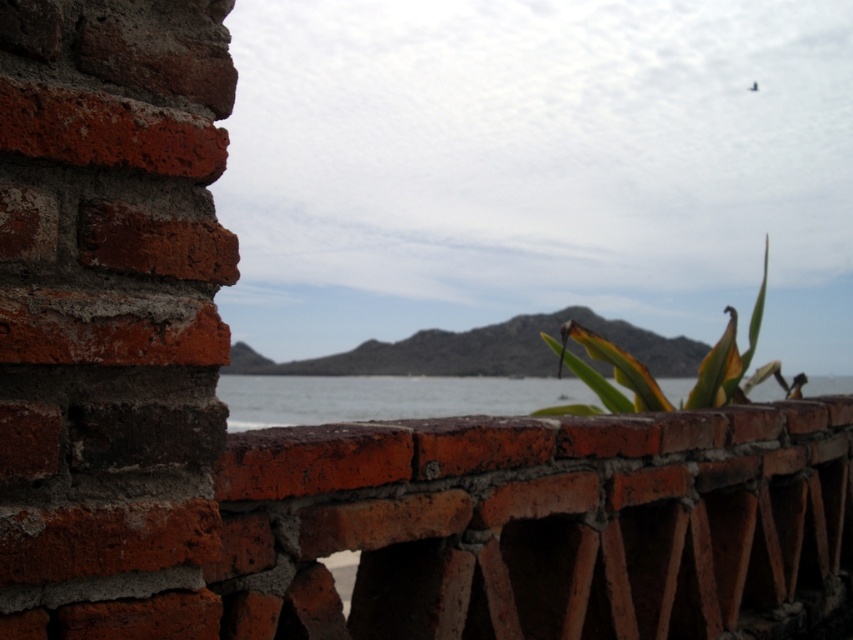
Question: Does clear water at center appear over green leafy plant at center?

Choices:
 (A) no
 (B) yes

Answer: (A)

Question: Among these objects, which one is farthest from the camera?

Choices:
 (A) clear water at center
 (B) green leafy plant at center

Answer: (B)

Question: Can you confirm if clear water at center is wider than green leafy plant at center?

Choices:
 (A) no
 (B) yes

Answer: (B)

Question: Which of the following is the farthest from the observer?

Choices:
 (A) green leafy plant at center
 (B) clear water at center

Answer: (A)

Question: Where is clear water at center located in relation to green leafy plant at center in the image?

Choices:
 (A) below
 (B) above

Answer: (A)

Question: Which of the following is the closest to the observer?

Choices:
 (A) (663, 396)
 (B) (227, 378)

Answer: (A)